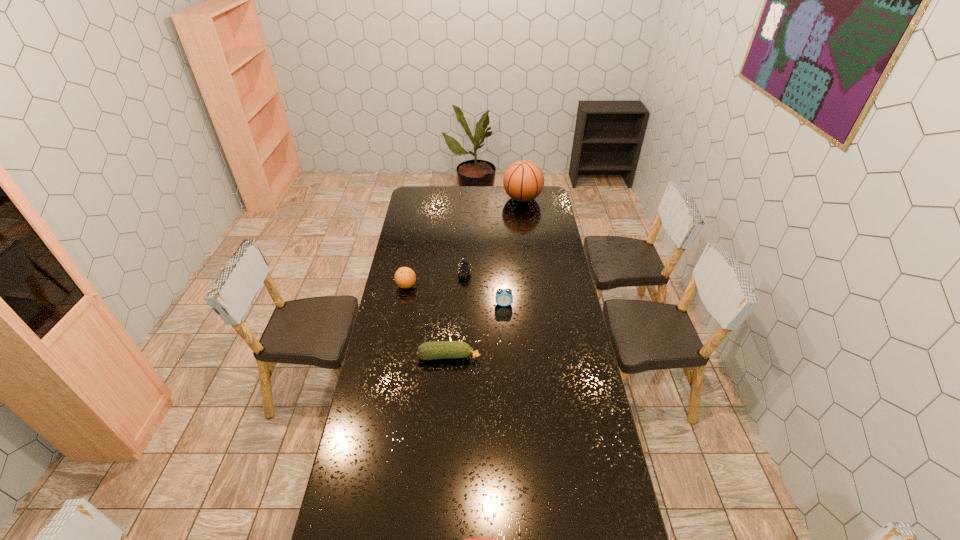
At what (x,y) coordinates should I click in order to perform the action: click on basketball. Please return your answer as a coordinate pair (x, y). The height and width of the screenshot is (540, 960). Looking at the image, I should click on (523, 181).

Where is `the farthest object`? the farthest object is located at coordinates (523, 181).

The width and height of the screenshot is (960, 540). I want to click on the leftmost object, so click(405, 277).

Find the location of `orange`. orange is located at coordinates tap(405, 277).

Locate an element on the screen. This screenshot has height=540, width=960. pinecone is located at coordinates (464, 268).

The height and width of the screenshot is (540, 960). I want to click on the farther alarm clock, so click(x=503, y=297).

Locate an element on the screen. the taller alarm clock is located at coordinates (503, 297).

Find the location of a particular element. The image size is (960, 540). the fifth tallest object is located at coordinates (431, 350).

Identify the location of the fifth farthest object. The image size is (960, 540). (431, 350).

Identify the location of vacant point located 0.370m on the left of the basketball. Image resolution: width=960 pixels, height=540 pixels. (444, 198).